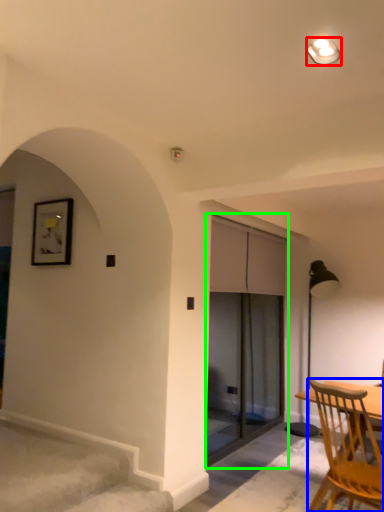
Question: Considering the real-world distances, which object is farthest from light fixture (highlighted by a red box)? chair (highlighted by a blue box) or screen door (highlighted by a green box)?

Choices:
 (A) chair
 (B) screen door

Answer: (B)